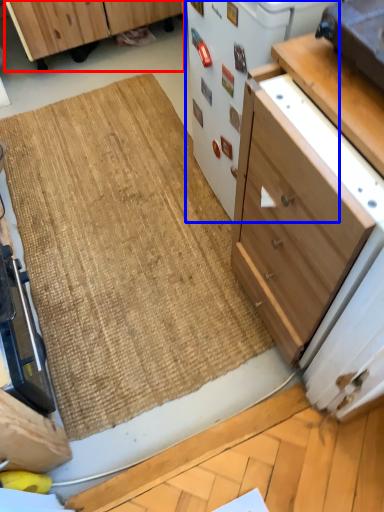
Question: Among these objects, which one is nearest to the camera, cabinetry (highlighted by a red box) or appliance (highlighted by a blue box)?

Choices:
 (A) cabinetry
 (B) appliance

Answer: (B)